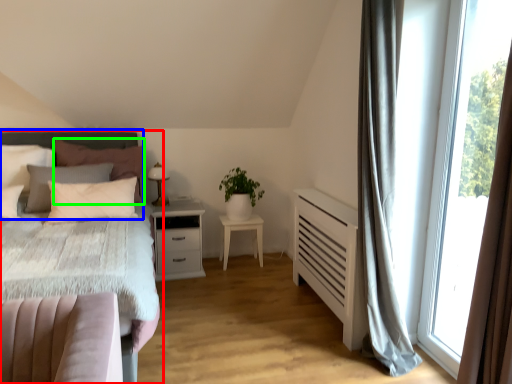
Question: Which object is positioned closest to bed (highlighted by a red box)? Select from headboard (highlighted by a blue box) and pillow (highlighted by a green box).

Choices:
 (A) headboard
 (B) pillow

Answer: (A)